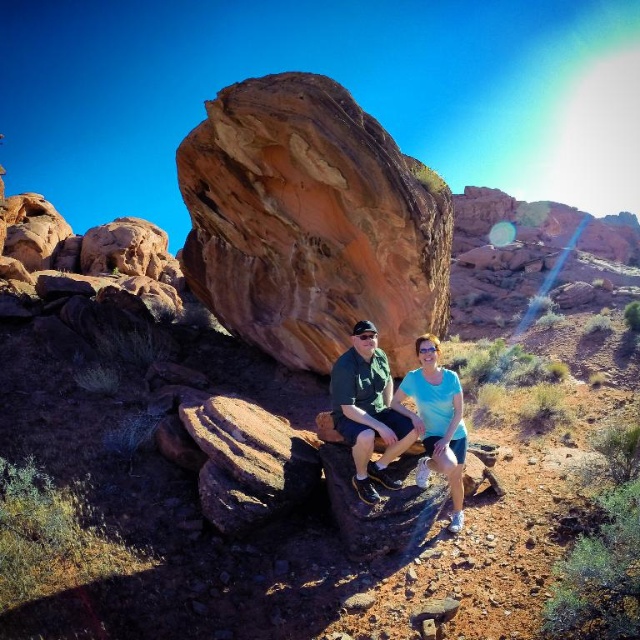
Question: Which of the following is the farthest from the observer?

Choices:
 (A) (454, 515)
 (B) (253, 182)

Answer: (B)

Question: Does rustic sandstone rock at center appear over matte green shorts at center?

Choices:
 (A) yes
 (B) no

Answer: (A)

Question: Is rustic sandstone rock at center to the left of matte green shorts at center from the viewer's perspective?

Choices:
 (A) yes
 (B) no

Answer: (A)

Question: Can you confirm if rustic sandstone rock at center is thinner than matte green shorts at center?

Choices:
 (A) yes
 (B) no

Answer: (A)

Question: Which point is farther to the camera?

Choices:
 (A) (365, 444)
 (B) (436, 292)

Answer: (B)